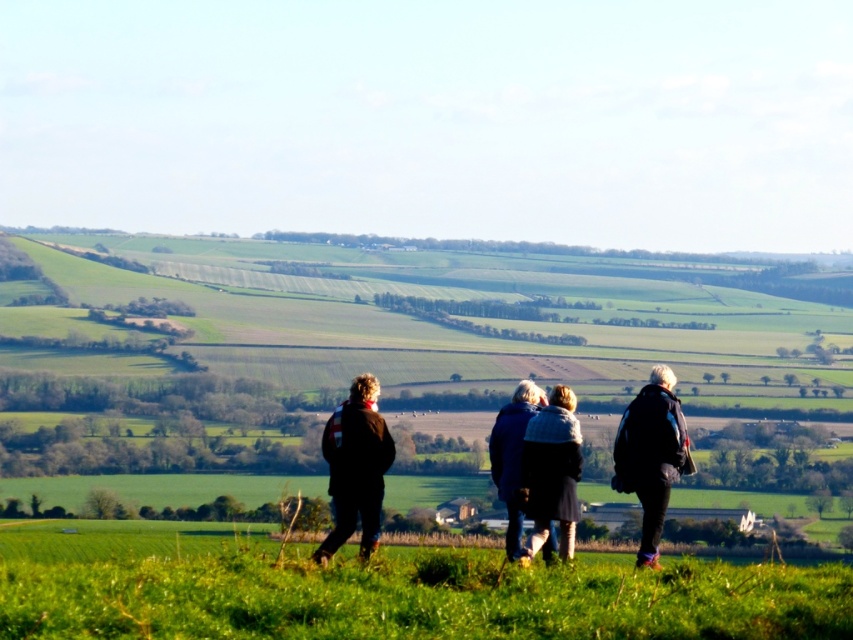
Question: Which object is the closest to the blue woolen sweater at center?

Choices:
 (A) dark blue jacket at center
 (B) knitted sweater at center
 (C) dark brown jacket at center

Answer: (B)

Question: Can you confirm if green grassy field at lower center is positioned to the right of dark brown jacket at center?

Choices:
 (A) no
 (B) yes

Answer: (A)

Question: Among these objects, which one is nearest to the camera?

Choices:
 (A) green grassy field at lower center
 (B) blue woolen sweater at center
 (C) knitted sweater at center
 (D) dark brown jacket at center

Answer: (A)

Question: Which point is farther to the camera?

Choices:
 (A) (253, 580)
 (B) (515, 451)
 (C) (532, 500)
 (D) (659, 468)

Answer: (B)

Question: Can you confirm if green grassy field at lower center is bigger than dark brown jacket at center?

Choices:
 (A) no
 (B) yes

Answer: (B)

Question: Does green grassy field at lower center appear on the right side of knitted sweater at center?

Choices:
 (A) no
 (B) yes

Answer: (A)